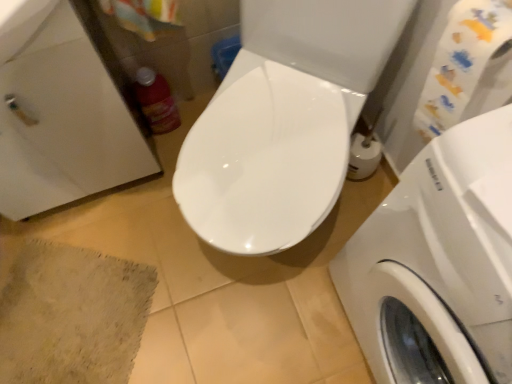
Where is `vacant region in front of white glossy sink at upper left`? Image resolution: width=512 pixels, height=384 pixels. vacant region in front of white glossy sink at upper left is located at coordinates (123, 249).